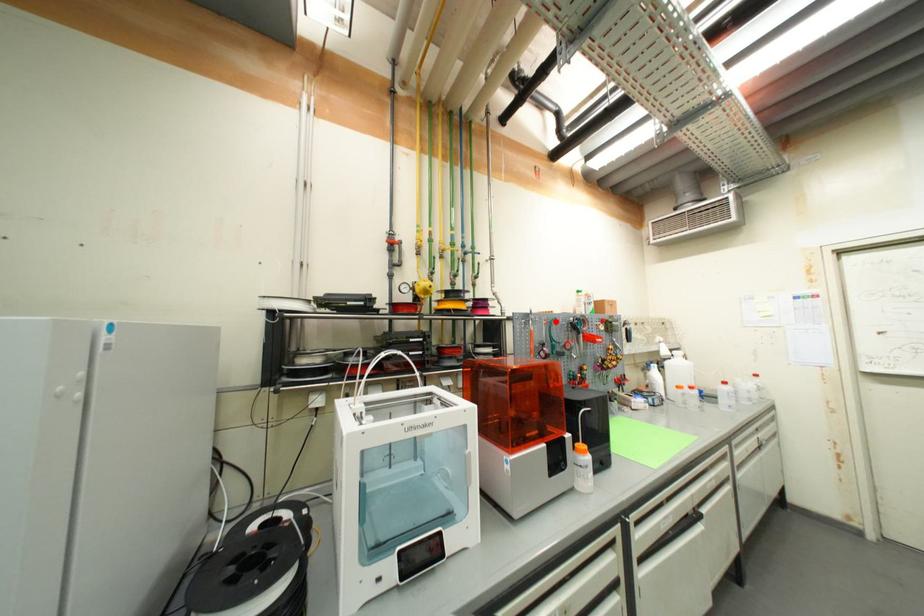
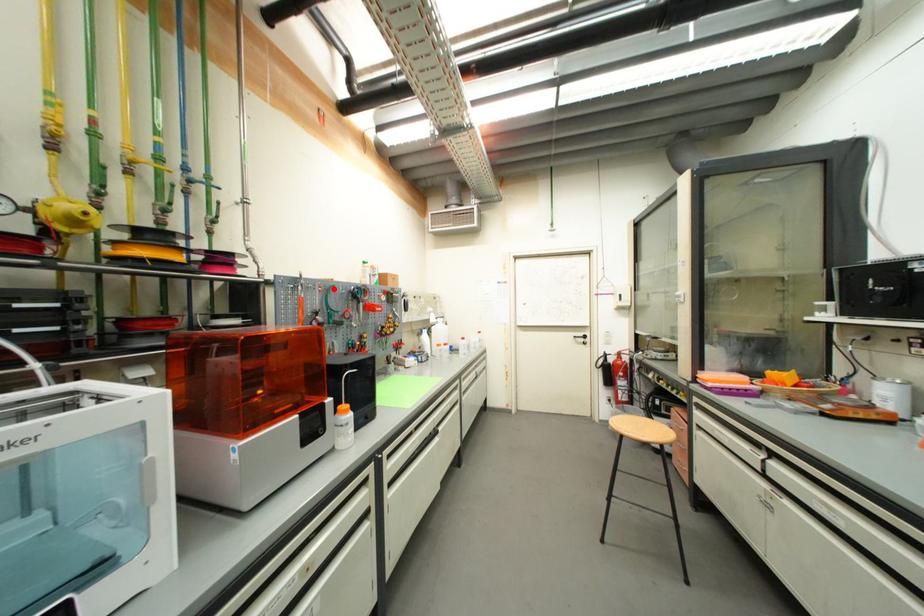
I am providing you with two images of the same scene from different viewpoints. A red point is marked on the first image and another point is marked on the second image. Do the highlighted points in image1 and image2 indicate the same real-world spot?

Yes